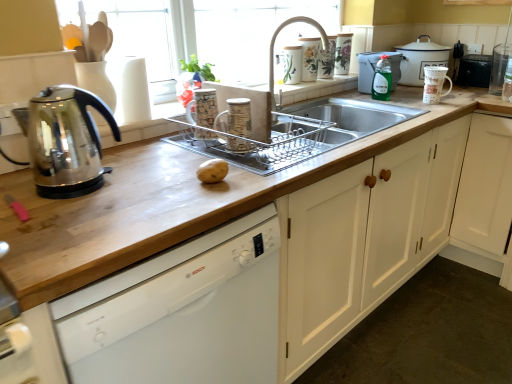
I want to click on vacant area that lies between matte ceramic mug at upper center, the second appliance in the left-to-right sequence, and transparent glass kettle at left, the first kitchen appliance in the left-to-right sequence, so [161, 162].